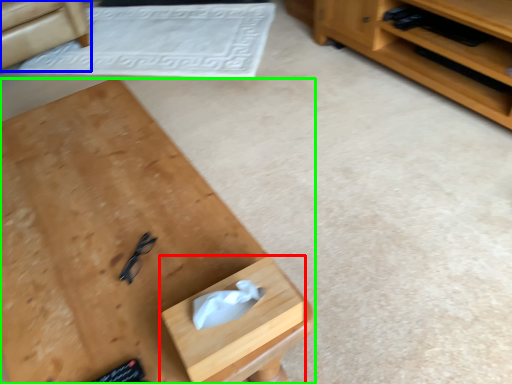
Question: Which object is positioned farthest from drawer (highlighted by a red box)? Select from armchair (highlighted by a blue box) and desk (highlighted by a green box).

Choices:
 (A) armchair
 (B) desk

Answer: (A)